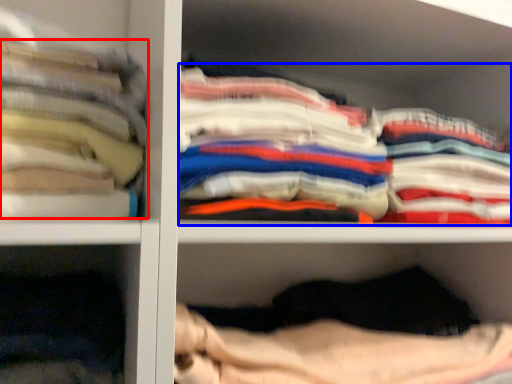
Question: Which of the following is the closest to the observer, clothing (highlighted by a red box) or clothing (highlighted by a blue box)?

Choices:
 (A) clothing
 (B) clothing

Answer: (A)